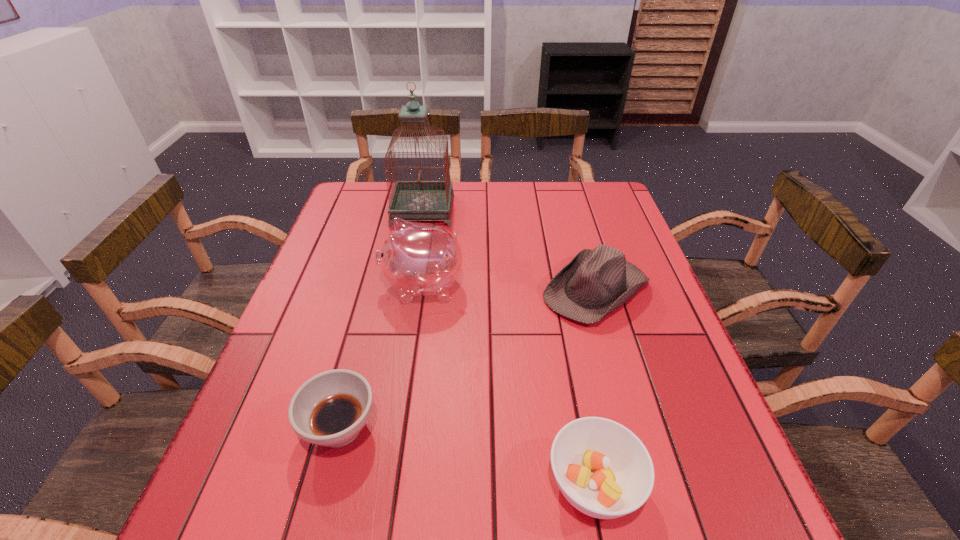
Find the location of a particular element. This screenshot has width=960, height=540. free space at the right edge of the desktop is located at coordinates (628, 254).

I want to click on free space at the far left corner of the desktop, so click(x=365, y=211).

This screenshot has width=960, height=540. What are the coordinates of `blank space at the far right corner` in the screenshot? It's located at (596, 186).

The height and width of the screenshot is (540, 960). I want to click on blank region between the fourth shortest object and the right soup bowl, so click(508, 386).

At what (x,y) coordinates should I click in order to perform the action: click on vacant region between the birdcage and the fedora. Please return your answer as a coordinate pair (x, y). Image resolution: width=960 pixels, height=540 pixels. Looking at the image, I should click on (509, 249).

Where is `free space between the left soup bowl and the piggy bank`? free space between the left soup bowl and the piggy bank is located at coordinates (381, 357).

Where is `free space between the piggy bank and the left soup bowl`? free space between the piggy bank and the left soup bowl is located at coordinates (381, 357).

This screenshot has width=960, height=540. In order to click on free space between the right soup bowl and the second tallest object in this screenshot , I will do `click(508, 386)`.

I want to click on free space between the third tallest object and the right soup bowl, so click(595, 387).

Image resolution: width=960 pixels, height=540 pixels. What are the coordinates of `vacant space that's between the birdcage and the right soup bowl` in the screenshot? It's located at (508, 347).